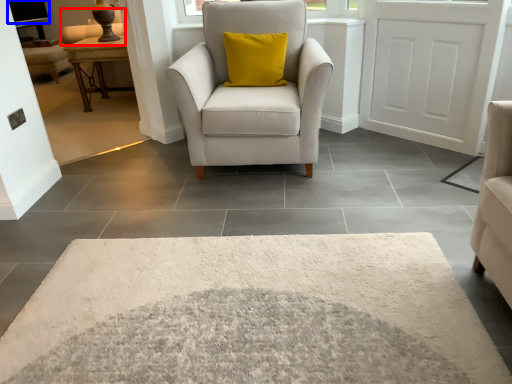
Question: Which object is closer to the camera taking this photo, couch (highlighted by a red box) or window screen (highlighted by a blue box)?

Choices:
 (A) couch
 (B) window screen

Answer: (A)